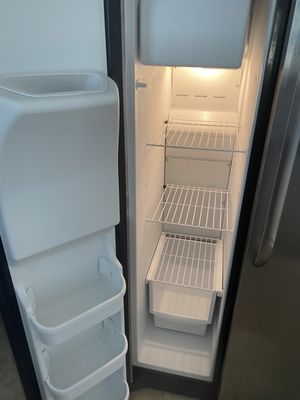
The image size is (300, 400). Find the location of `empty space inside of fridge`. empty space inside of fridge is located at coordinates (190, 175).